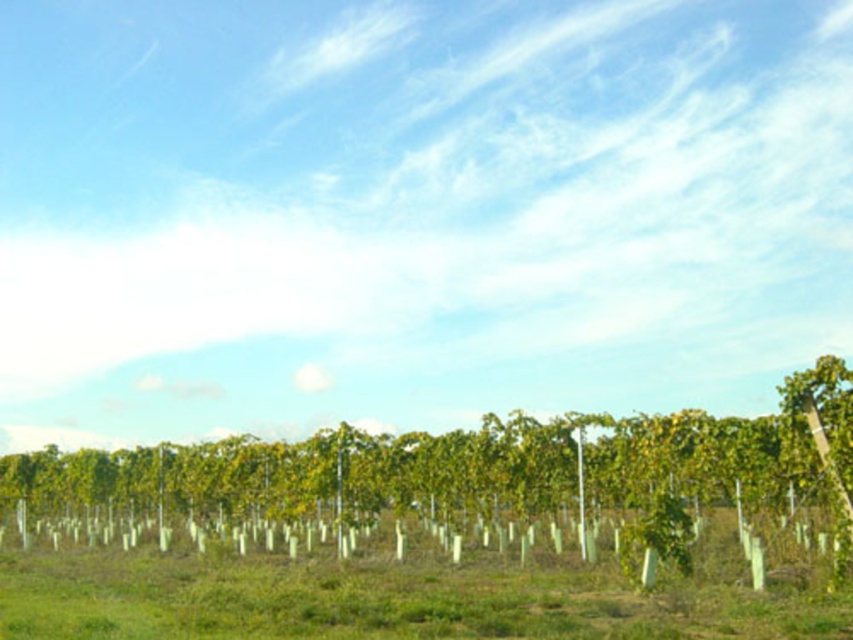
Question: Which point is closer to the camera taking this photo?

Choices:
 (A) (556, 445)
 (B) (204, 582)

Answer: (B)

Question: Does green leafy tree at center have a larger size compared to green leafy plants at center?

Choices:
 (A) yes
 (B) no

Answer: (A)

Question: Considering the relative positions of green leafy tree at center and green leafy plants at center in the image provided, where is green leafy tree at center located with respect to green leafy plants at center?

Choices:
 (A) below
 (B) above

Answer: (A)

Question: Is green leafy tree at center thinner than green leafy plants at center?

Choices:
 (A) yes
 (B) no

Answer: (B)

Question: Which object appears closest to the camera in this image?

Choices:
 (A) green leafy tree at center
 (B) green leafy plants at center

Answer: (B)